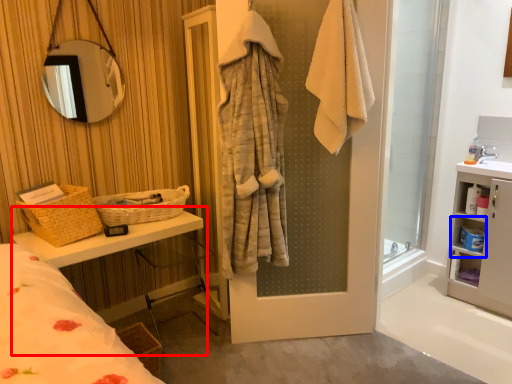
Question: Which of the following is the farthest to the observer, vanity (highlighted by a red box) or cabinet (highlighted by a blue box)?

Choices:
 (A) vanity
 (B) cabinet

Answer: (B)